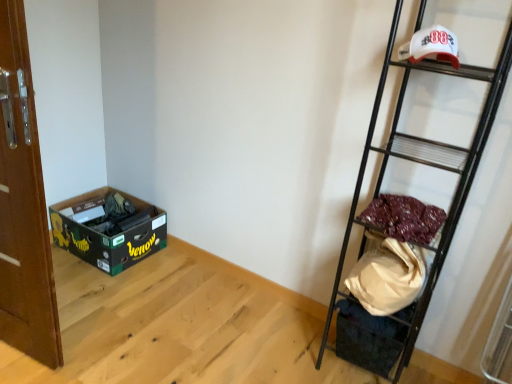
The height and width of the screenshot is (384, 512). Identify the location of free point to the right of brown wooden door at left. (103, 341).